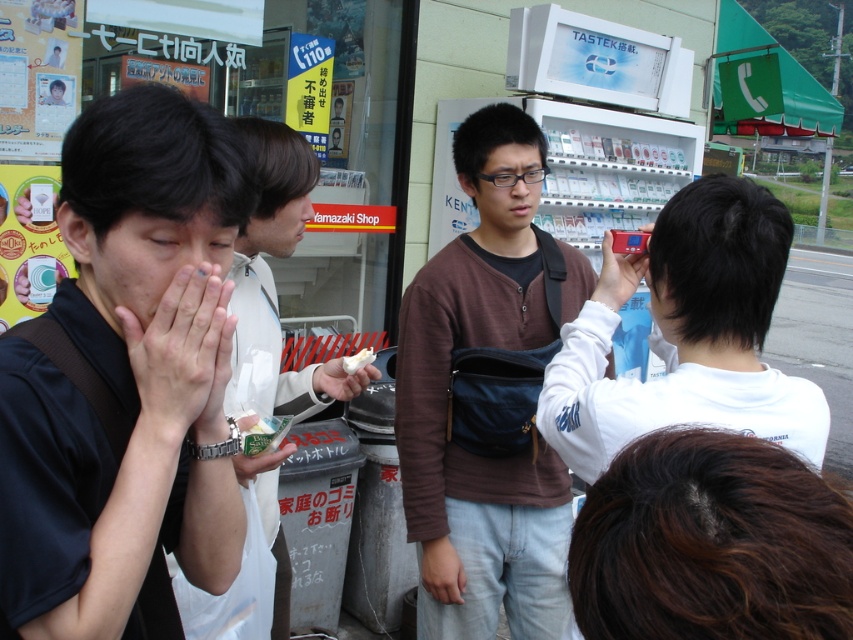
Who is taller, matte black camera at right or white matte paper at center?

matte black camera at right is taller.

Between matte black camera at right and white matte paper at center, which one is positioned lower?

white matte paper at center is below.

Is point (820, 420) positioned behind point (318, 371)?

No, (820, 420) is closer to viewer.

This screenshot has height=640, width=853. In order to click on matte black camera at right in this screenshot , I will do `click(686, 333)`.

Based on the photo, can you confirm if brown cotton sweater at center is positioned above white matte paper at center?

No.

Can you confirm if brown cotton sweater at center is positioned to the right of white matte paper at center?

Yes, brown cotton sweater at center is to the right of white matte paper at center.

Locate an element on the screen. The image size is (853, 640). brown cotton sweater at center is located at coordinates (453, 397).

Where is `white matte shirt at center`? white matte shirt at center is located at coordinates (270, 273).

Does white matte shirt at center come behind white matte paper at center?

No, it is in front of white matte paper at center.

I want to click on white matte shirt at center, so click(x=270, y=273).